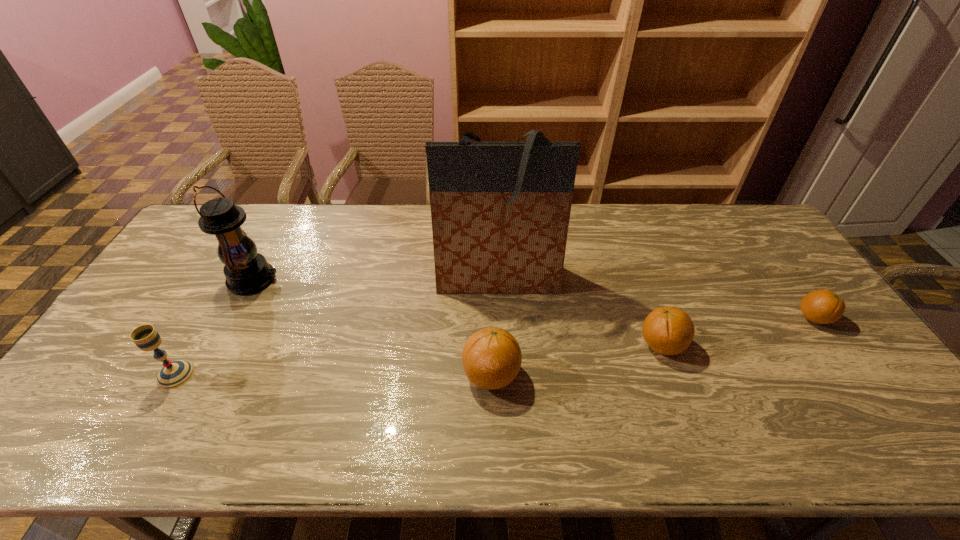
You are a GUI agent. You are given a task and a screenshot of the screen. Output one action in this format:
    pyautogui.click(x=<x>, y=<y>)
    Task: Click on the free location at the right edge of the desktop
    The width and height of the screenshot is (960, 540).
    Given the screenshot: What is the action you would take?
    pyautogui.click(x=807, y=288)

I want to click on vacant space at the far right corner, so [754, 213].

Where is `vacant area that lies between the leftmost orange and the lantern`? vacant area that lies between the leftmost orange and the lantern is located at coordinates (372, 327).

Where is `vacant area between the tallest orange and the chalice`? vacant area between the tallest orange and the chalice is located at coordinates (333, 375).

Find the location of a particular element. This screenshot has height=540, width=960. free space between the second orange from right to left and the shopping bag is located at coordinates (580, 313).

At what (x,y) coordinates should I click in order to perform the action: click on empty space that is in between the fifth object from left to right and the shopping bag. Please return your answer as a coordinate pair (x, y). This screenshot has width=960, height=540. Looking at the image, I should click on (580, 313).

Where is `vacant space that is in between the chalice and the second orange from left to right`? The width and height of the screenshot is (960, 540). vacant space that is in between the chalice and the second orange from left to right is located at coordinates (419, 360).

The height and width of the screenshot is (540, 960). I want to click on free point between the second tallest orange and the fifth shortest object, so click(458, 312).

The width and height of the screenshot is (960, 540). In order to click on vacant region between the fifth shortest object and the tallest object in this screenshot , I will do `click(375, 280)`.

The height and width of the screenshot is (540, 960). I want to click on vacant region between the second shortest orange and the rightmost object, so click(x=738, y=332).